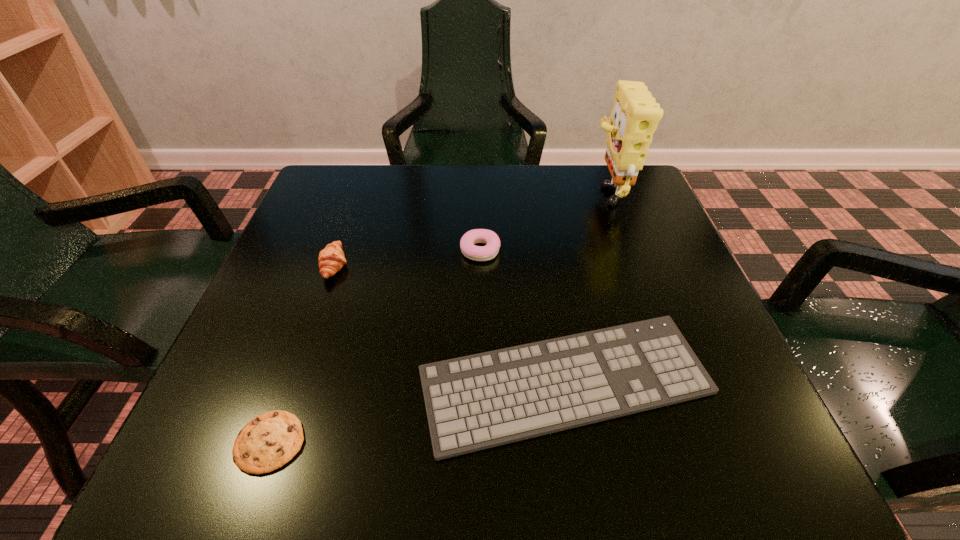
Find the location of `the farthest object`. the farthest object is located at coordinates (635, 115).

This screenshot has width=960, height=540. What are the coordinates of `the tallest object` in the screenshot? It's located at (635, 115).

Where is `the taller pastry`? the taller pastry is located at coordinates (331, 259).

Identify the location of the fourth shortest object. (331, 259).

You are a GUI agent. You are given a task and a screenshot of the screen. Output one action in this format:
    pyautogui.click(x=<x>, y=<y>)
    Task: Click on the shorter pastry
    
    Given the screenshot: What is the action you would take?
    pyautogui.click(x=477, y=253)

Find the location of a particular element. This screenshot has height=540, width=960. the right pastry is located at coordinates (477, 253).

Where is `the fourth tallest object`? The image size is (960, 540). the fourth tallest object is located at coordinates (480, 401).

Where is `cookie`? The width and height of the screenshot is (960, 540). cookie is located at coordinates (267, 442).

Locate an element on the screen. The height and width of the screenshot is (540, 960). vacant region located on the face of the farthest object is located at coordinates (422, 191).

Where is `vacant area located 0.290m on the face of the farthest object`? The image size is (960, 540). vacant area located 0.290m on the face of the farthest object is located at coordinates (468, 191).